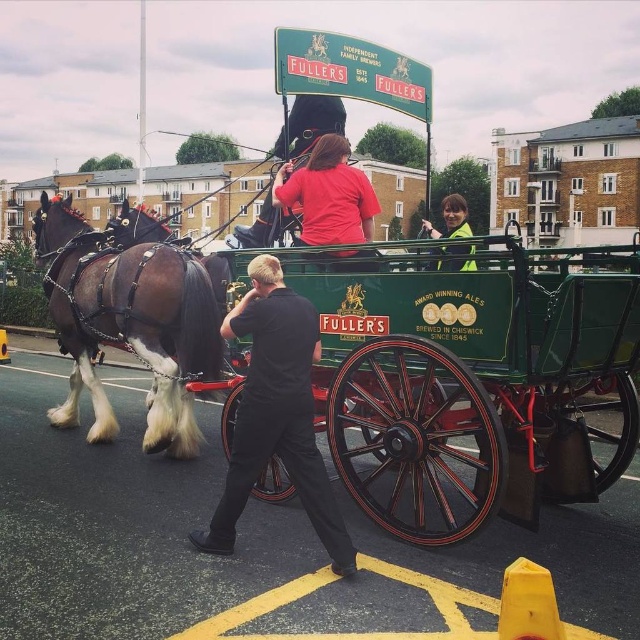
Is brown glossy horse at left above reflective yellow vest at upper right?

Actually, brown glossy horse at left is below reflective yellow vest at upper right.

Who is more distant from viewer, (204, 298) or (449, 262)?

The point (204, 298) is behind.

Is point (205, 317) positioned in front of point (451, 268)?

That is False.

The height and width of the screenshot is (640, 640). I want to click on brown glossy horse at left, so click(129, 324).

Which is below, brown glossy horse at left or matte red shirt at center?

brown glossy horse at left is lower down.

Is brown glossy horse at left below matte red shirt at center?

Yes.

This screenshot has width=640, height=640. I want to click on brown glossy horse at left, so click(129, 324).

At what (x,y) coordinates should I click in order to perform the action: click on brown glossy horse at left. Please return your answer as a coordinate pair (x, y). Image resolution: width=640 pixels, height=640 pixels. Looking at the image, I should click on (129, 324).

Looking at this image, can you confirm if green polished wood wagon at center is positioned to the right of reflective yellow vest at upper right?

In fact, green polished wood wagon at center is to the left of reflective yellow vest at upper right.

Who is more forward, (410, 419) or (445, 236)?

Point (410, 419)

Where is `green polished wood wagon at center`? green polished wood wagon at center is located at coordinates (474, 380).